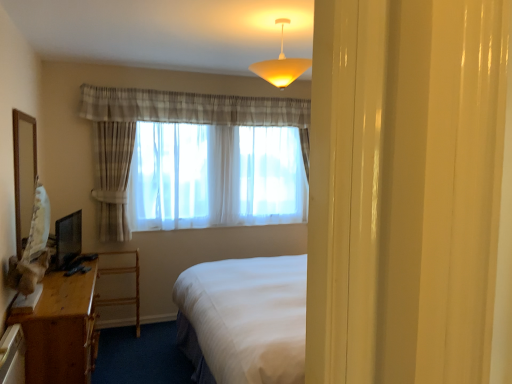
Question: Does wooden mirror at left have a lesser height compared to sheer white curtain at center?

Choices:
 (A) no
 (B) yes

Answer: (B)

Question: Can you confirm if wooden mirror at left is taller than sheer white curtain at center?

Choices:
 (A) yes
 (B) no

Answer: (B)

Question: Is wooden mirror at left facing away from sheer white curtain at center?

Choices:
 (A) no
 (B) yes

Answer: (A)

Question: From the image's perspective, is wooden mirror at left beneath sheer white curtain at center?

Choices:
 (A) no
 (B) yes

Answer: (B)

Question: Is wooden mirror at left at the right side of sheer white curtain at center?

Choices:
 (A) no
 (B) yes

Answer: (A)

Question: Considering the relative sizes of wooden mirror at left and sheer white curtain at center in the image provided, is wooden mirror at left wider than sheer white curtain at center?

Choices:
 (A) no
 (B) yes

Answer: (A)

Question: Considering the relative positions of wooden mirror at left and matte yellow plastic lampshade at upper center in the image provided, is wooden mirror at left to the right of matte yellow plastic lampshade at upper center from the viewer's perspective?

Choices:
 (A) yes
 (B) no

Answer: (B)

Question: Is wooden mirror at left at the left side of matte yellow plastic lampshade at upper center?

Choices:
 (A) no
 (B) yes

Answer: (B)

Question: Does wooden mirror at left have a larger size compared to matte yellow plastic lampshade at upper center?

Choices:
 (A) yes
 (B) no

Answer: (B)

Question: From a real-world perspective, is wooden mirror at left physically below matte yellow plastic lampshade at upper center?

Choices:
 (A) no
 (B) yes

Answer: (B)

Question: Is wooden mirror at left turned away from matte yellow plastic lampshade at upper center?

Choices:
 (A) yes
 (B) no

Answer: (B)

Question: Does wooden mirror at left come in front of matte yellow plastic lampshade at upper center?

Choices:
 (A) no
 (B) yes

Answer: (A)

Question: From a real-world perspective, is sheer white curtain at center beneath matte black monitor at left?

Choices:
 (A) yes
 (B) no

Answer: (B)